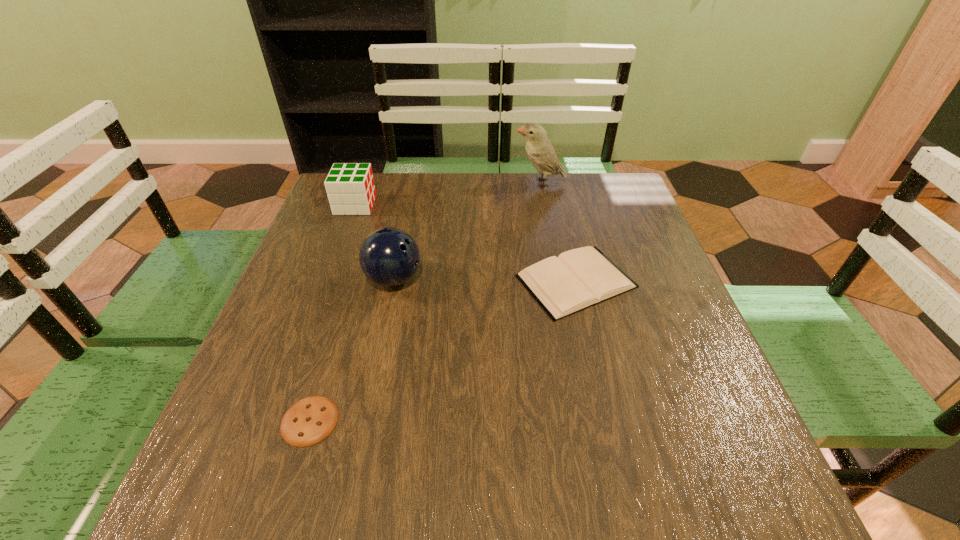
Locate an element on the screen. vacant space that satisfies the following two spatial constraints: 1. on the surface of the hardback book near the finger holes; 2. on the left side of the bowling ball is located at coordinates (394, 281).

Find the location of a particular element. free point that satisfies the following two spatial constraints: 1. on the surface of the fourth shortest object near the finger holes; 2. on the left side of the second shortest object is located at coordinates (394, 281).

The width and height of the screenshot is (960, 540). I want to click on free space that satisfies the following two spatial constraints: 1. on the surface of the second tallest object near the finger holes; 2. on the left side of the second shortest object, so click(394, 281).

Identify the location of vacant area that satisfies the following two spatial constraints: 1. on the back side of the hardback book; 2. on the surface of the fourth shortest object near the finger holes. This screenshot has width=960, height=540. (576, 279).

Image resolution: width=960 pixels, height=540 pixels. Identify the location of vacant space that satisfies the following two spatial constraints: 1. on the red face of the hardback book; 2. on the right side of the second farthest object. (327, 281).

Find the location of `vacant space that satisfies the following two spatial constraints: 1. on the surface of the bowling ball near the finger holes; 2. on the right side of the hardback book`. vacant space that satisfies the following two spatial constraints: 1. on the surface of the bowling ball near the finger holes; 2. on the right side of the hardback book is located at coordinates (394, 281).

You are a GUI agent. You are given a task and a screenshot of the screen. Output one action in this format:
    pyautogui.click(x=<x>, y=<y>)
    Task: Click on the free space that satisfies the following two spatial constraints: 1. on the surface of the fourth shortest object near the finger holes; 2. on the front side of the shortest object
    The height and width of the screenshot is (540, 960).
    Given the screenshot: What is the action you would take?
    pyautogui.click(x=364, y=421)